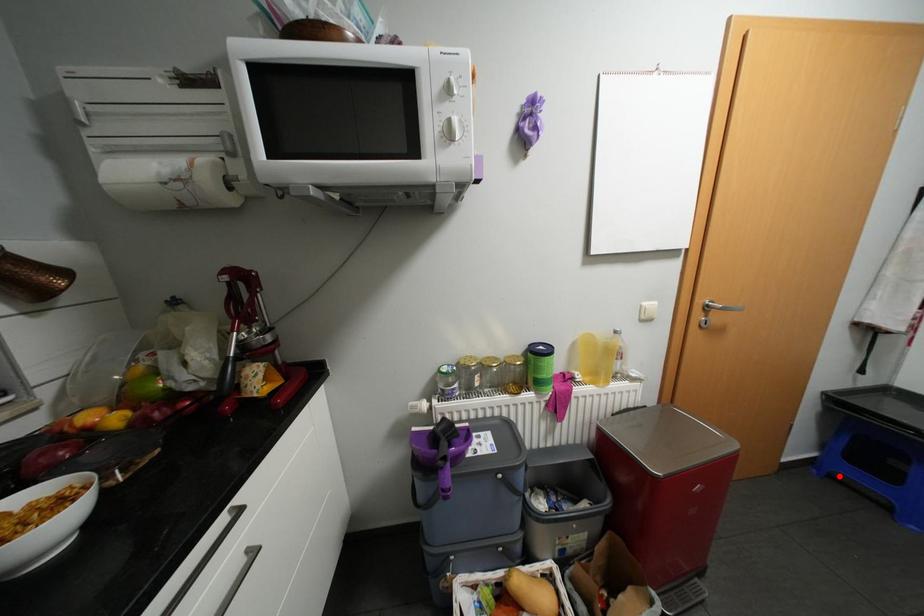
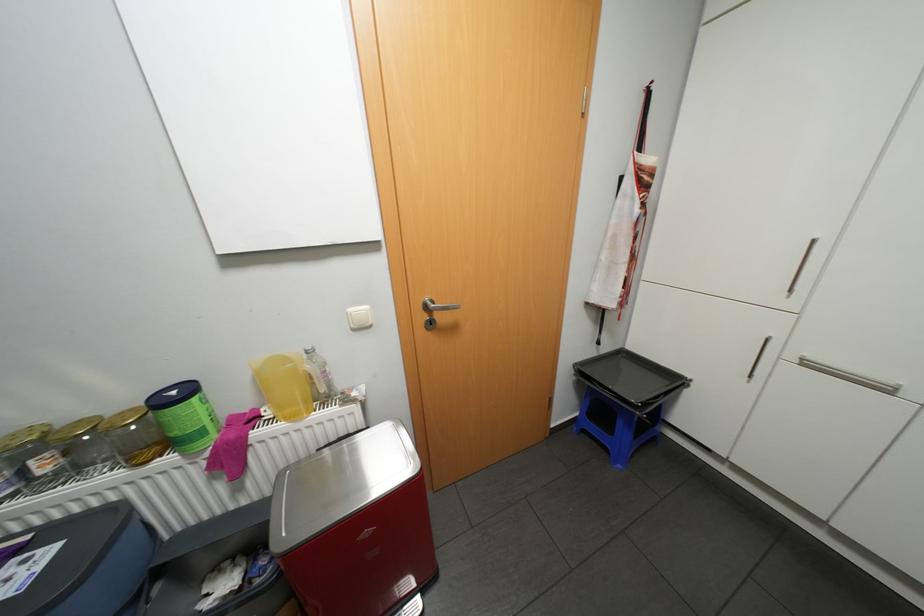
Where in the second image is the point corresponding to the highlighted location from the first image?

(591, 431)